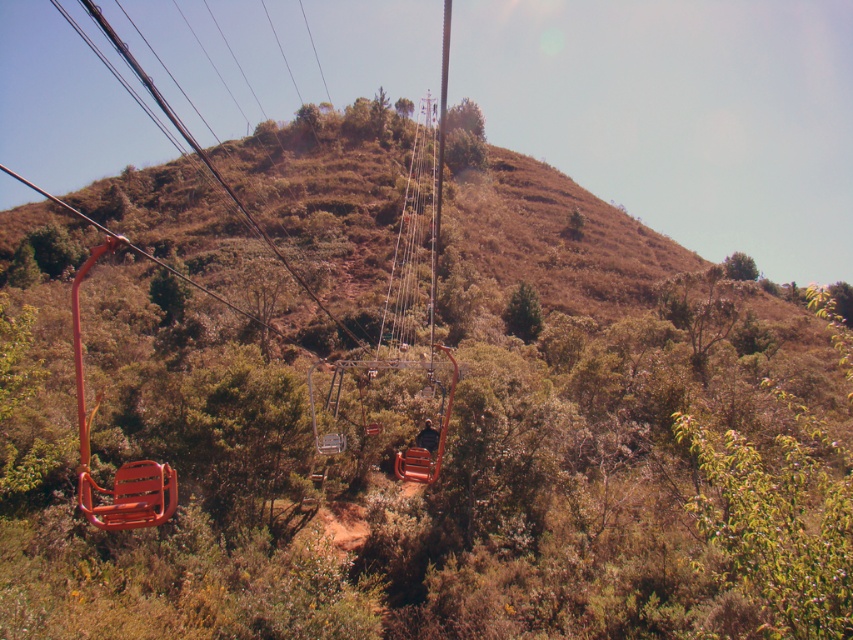
Question: Observing the image, what is the correct spatial positioning of orange plastic power line at left in reference to metallic wire at left?

Choices:
 (A) left
 (B) right

Answer: (B)

Question: Which point appears closest to the camera in this image?

Choices:
 (A) (259, 321)
 (B) (160, 97)

Answer: (A)

Question: Among these objects, which one is farthest from the camera?

Choices:
 (A) metallic wire at left
 (B) orange plastic power line at left

Answer: (B)

Question: Does orange plastic power line at left have a lesser width compared to metallic wire at left?

Choices:
 (A) no
 (B) yes

Answer: (B)

Question: Which point is farther to the camera?

Choices:
 (A) (256, 227)
 (B) (4, 168)

Answer: (B)

Question: Is orange plastic power line at left to the left of metallic wire at left from the viewer's perspective?

Choices:
 (A) no
 (B) yes

Answer: (A)